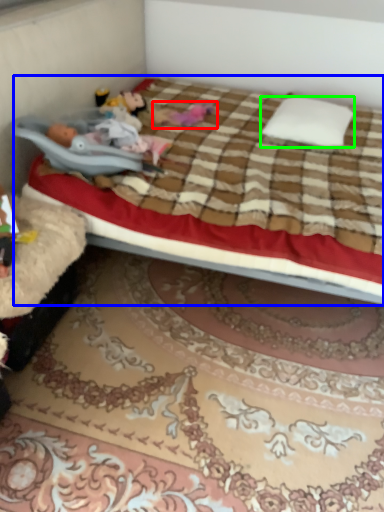
Question: Considering the real-world distances, which object is farthest from toy (highlighted by a red box)? bed (highlighted by a blue box) or pillow (highlighted by a green box)?

Choices:
 (A) bed
 (B) pillow

Answer: (A)